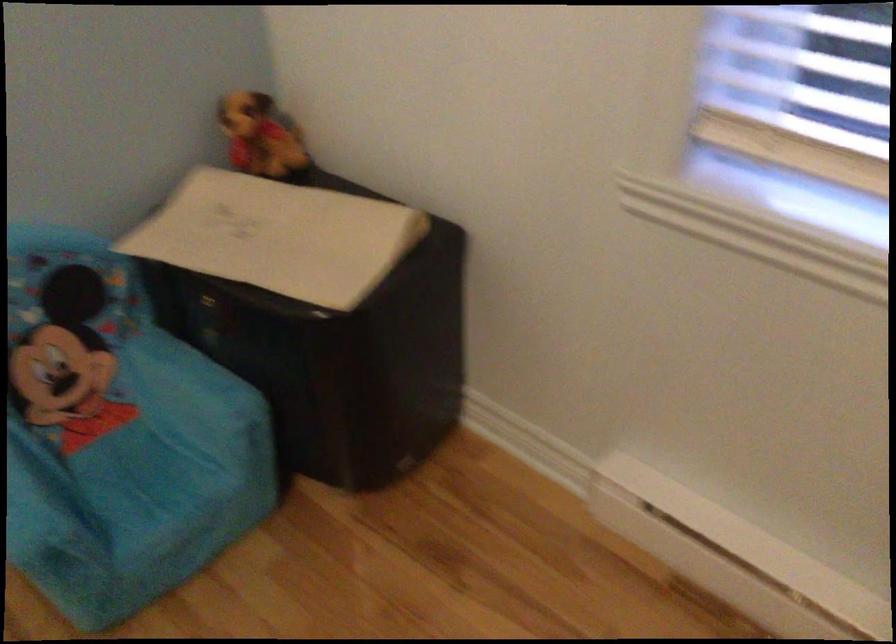
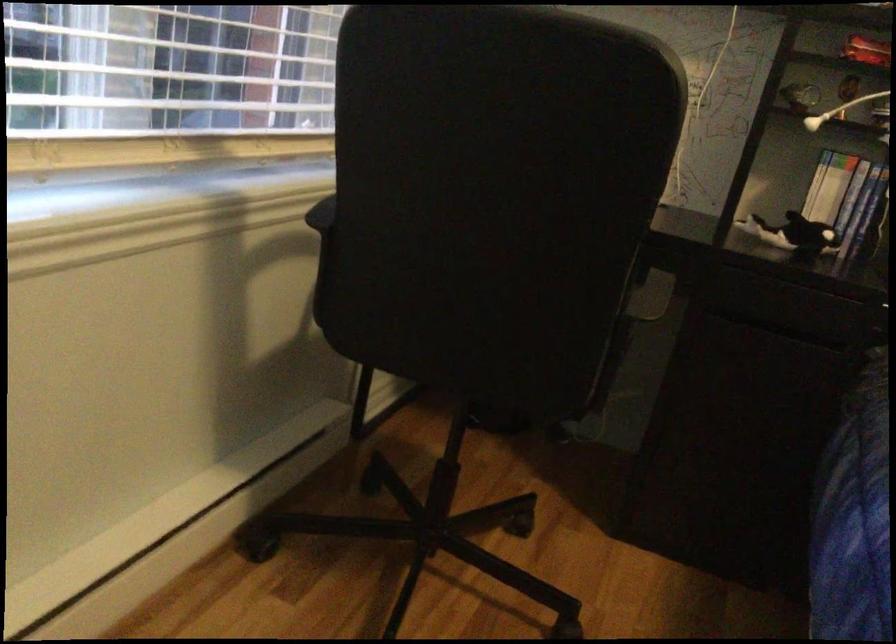
First-person continuous shooting, in which direction is the camera rotating?

The camera's rotation is toward right-down.